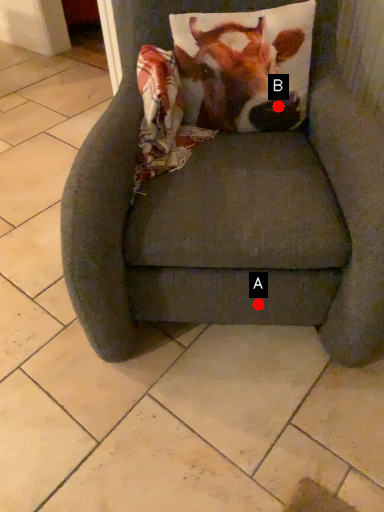
Question: Two points are circled on the image, labeled by A and B beside each circle. Which point is farther from the camera taking this photo?

Choices:
 (A) A is further
 (B) B is further

Answer: (B)